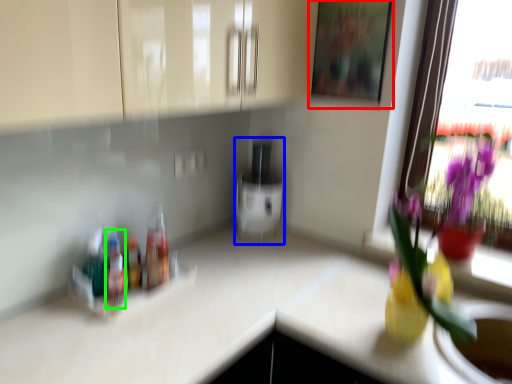
Question: Which object is the farthest from picture frame (highlighted by a red box)? Choose among these: appliance (highlighted by a blue box) or bottle (highlighted by a green box).

Choices:
 (A) appliance
 (B) bottle

Answer: (B)